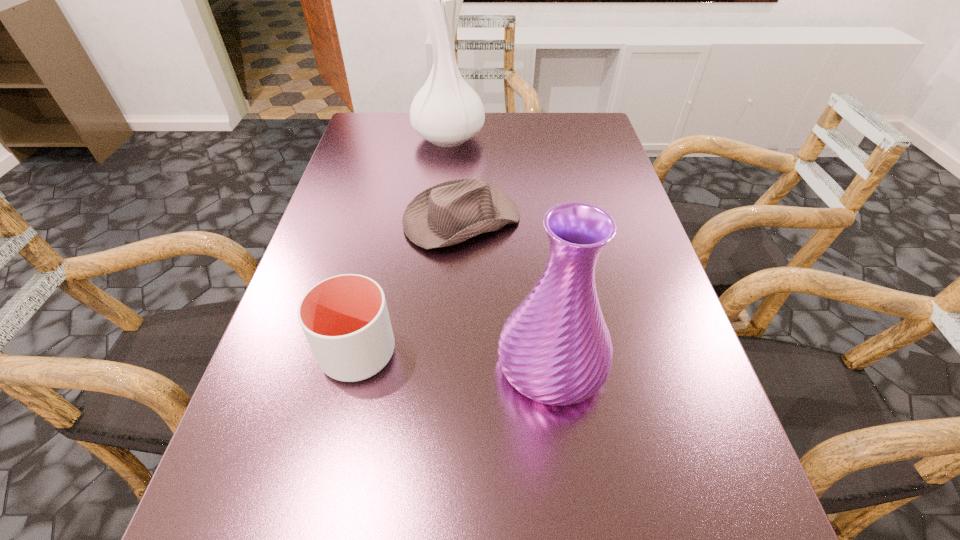
What are the coordinates of `free space located 0.330m on the front of the shortest object` in the screenshot? It's located at (453, 396).

Locate an element on the screen. This screenshot has height=540, width=960. object that is at the far edge is located at coordinates (447, 112).

I want to click on object at the left edge, so click(345, 318).

Locate an element on the screen. This screenshot has height=540, width=960. object at the right edge is located at coordinates (555, 348).

Find the location of a particular element. vacant region at the far edge of the desktop is located at coordinates (477, 137).

The width and height of the screenshot is (960, 540). In order to click on free space at the left edge of the desktop in this screenshot , I will do `click(325, 215)`.

I want to click on free space at the right edge, so click(714, 408).

This screenshot has height=540, width=960. I want to click on empty space that is in between the farther vase and the nearer vase, so click(500, 251).

Image resolution: width=960 pixels, height=540 pixels. I want to click on free area in between the fedora and the farther vase, so click(455, 179).

The height and width of the screenshot is (540, 960). I want to click on unoccupied position between the shortest object and the third tallest object, so click(410, 287).